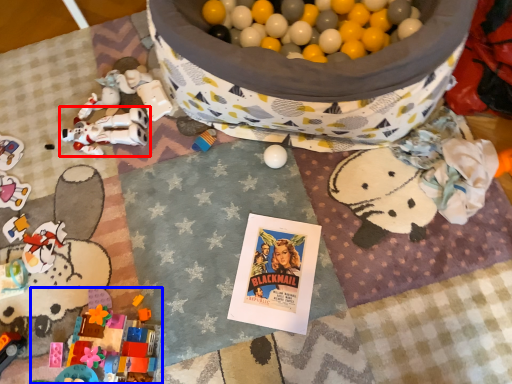
Question: Which object appears closest to the camera in this image, toy (highlighted by a red box) or toy (highlighted by a blue box)?

Choices:
 (A) toy
 (B) toy

Answer: (B)